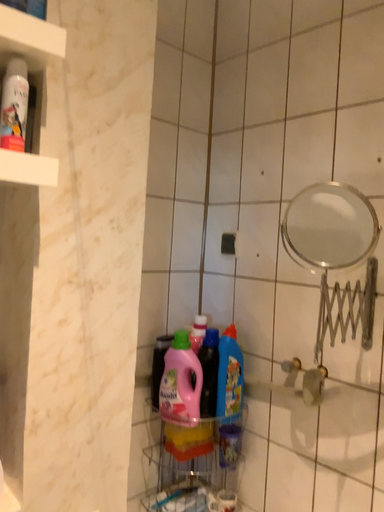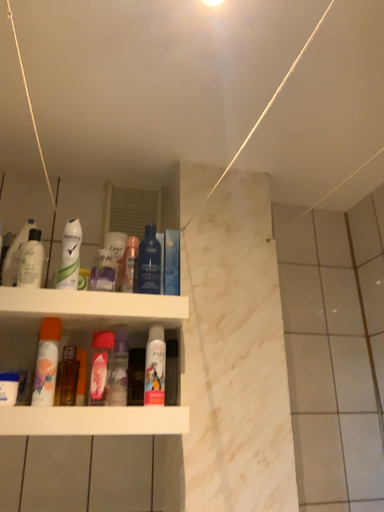
Question: How did the camera likely rotate when shooting the video?

Choices:
 (A) rotated downward
 (B) rotated upward

Answer: (B)